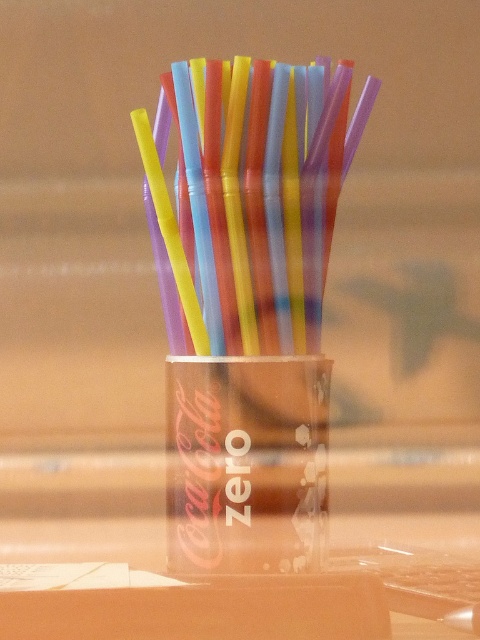
Question: Which point is closer to the camera?

Choices:
 (A) (192, 301)
 (B) (283, 419)

Answer: (B)

Question: Does translucent plastic straws at center have a smaller size compared to transparent plastic cup at center?

Choices:
 (A) no
 (B) yes

Answer: (A)

Question: Can you confirm if translucent plastic straws at center is smaller than transparent plastic cup at center?

Choices:
 (A) yes
 (B) no

Answer: (B)

Question: Which object appears closest to the camera in this image?

Choices:
 (A) translucent plastic straws at center
 (B) transparent plastic cup at center

Answer: (A)

Question: Is translucent plastic straws at center wider than transparent plastic cup at center?

Choices:
 (A) no
 (B) yes

Answer: (B)